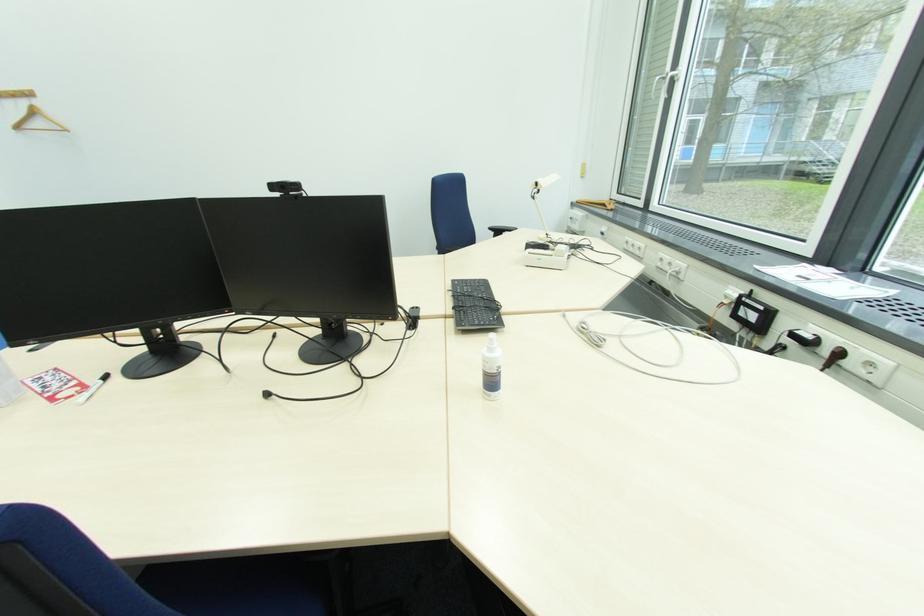
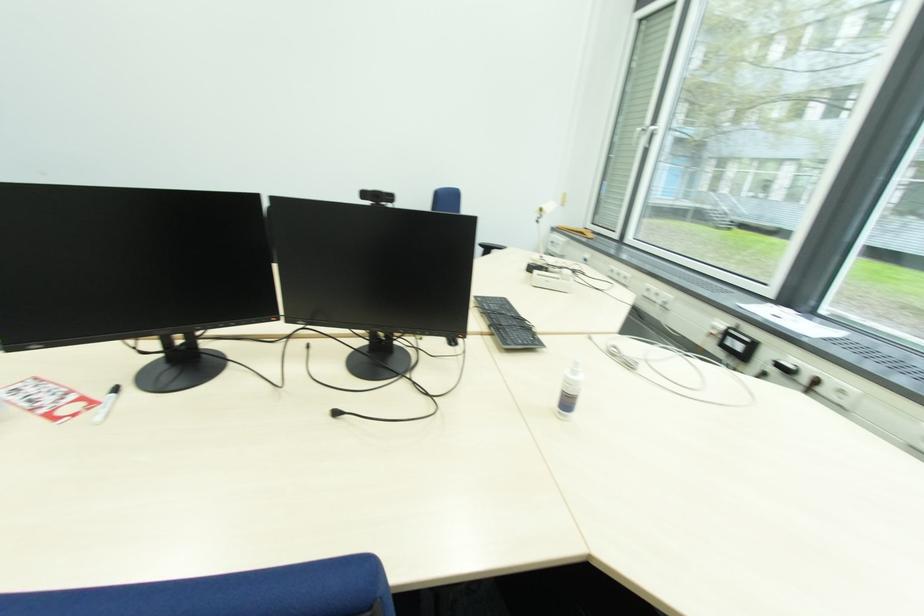
The point at (748, 301) is marked in the first image. Where is the corresponding point in the second image?

(734, 333)